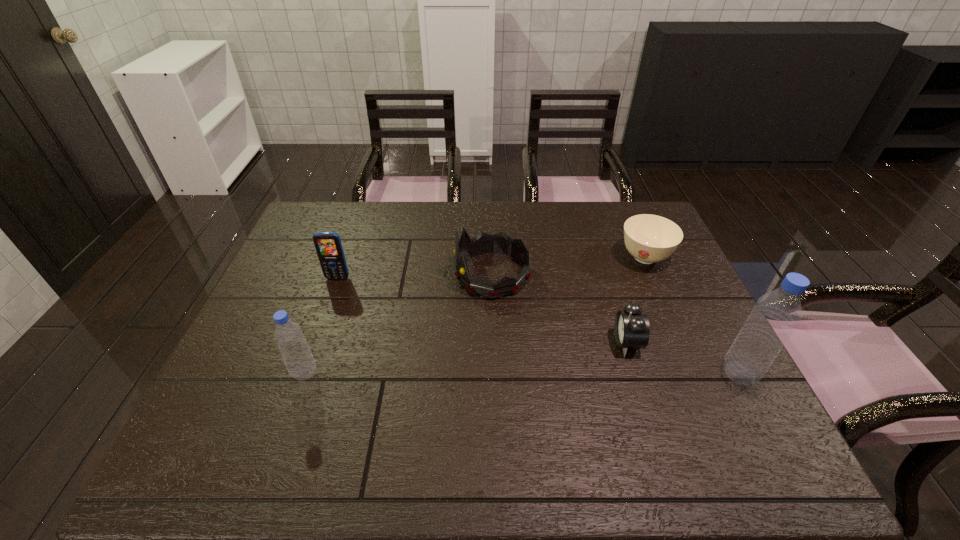
Locate an element on the screen. bottle that is at the left edge is located at coordinates (300, 363).

At what (x,y) coordinates should I click in order to perform the action: click on cellular telephone at the left edge. Please return your answer as a coordinate pair (x, y). The height and width of the screenshot is (540, 960). Looking at the image, I should click on (328, 245).

You are a GUI agent. You are given a task and a screenshot of the screen. Output one action in this format:
    pyautogui.click(x=<x>, y=<y>)
    Task: Click on the bottle that is at the right edge
    The width and height of the screenshot is (960, 540).
    Given the screenshot: What is the action you would take?
    pyautogui.click(x=776, y=314)

The image size is (960, 540). I want to click on sugar bowl at the right edge, so click(648, 238).

You are a GUI agent. You are given a task and a screenshot of the screen. Output one action in this format:
    pyautogui.click(x=<x>, y=<y>)
    Task: Click on the object positioned at the far right corner
    Image resolution: width=960 pixels, height=540 pixels.
    Given the screenshot: What is the action you would take?
    pyautogui.click(x=648, y=238)

At what (x,y) coordinates should I click in order to perform the action: click on object that is at the near right corner. Please return your answer as a coordinate pair (x, y). The width and height of the screenshot is (960, 540). Looking at the image, I should click on (776, 314).

This screenshot has width=960, height=540. Find the location of `free space at the far edge of the desktop`. free space at the far edge of the desktop is located at coordinates (552, 236).

Identify the location of vacant space at the near edge of the desktop. This screenshot has height=540, width=960. (588, 416).

This screenshot has width=960, height=540. In the image, there is a desktop. Identify the location of vacant space at the left edge. click(273, 367).

At what (x,y) coordinates should I click in order to perform the action: click on free spot at the right edge of the desktop. Please return your answer as a coordinate pair (x, y). Looking at the image, I should click on (721, 340).